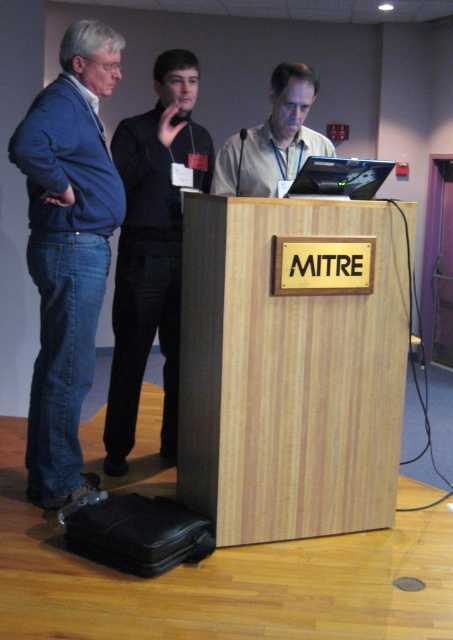
Is wooden podium at center bigger than black cotton shirt at left?

Indeed, wooden podium at center has a larger size compared to black cotton shirt at left.

Is point (322, 317) farther from camera compared to point (149, 316)?

No, it is in front of (149, 316).

Between point (304, 394) and point (203, 140), which one is positioned behind?

The point (203, 140) is more distant.

Where is `wooden podium at center`? The height and width of the screenshot is (640, 453). wooden podium at center is located at coordinates (289, 374).

Is wooden podium at center bigger than matte light brown laptop at center?

Yes.

Is point (247, 289) closer to camera compared to point (258, 164)?

Yes, it is in front of point (258, 164).

Who is more forward, (213, 513) or (222, 157)?

Point (213, 513) is more forward.

In order to click on wooden podium at center in this screenshot , I will do `click(289, 374)`.

Which is behind, point (48, 321) or point (269, 189)?

The point (269, 189) is behind.

Is point (44, 160) closer to viewer compared to point (229, 172)?

Yes, it is in front of point (229, 172).

Where is `blue denim jeans at left`? The image size is (453, 640). blue denim jeans at left is located at coordinates (67, 250).